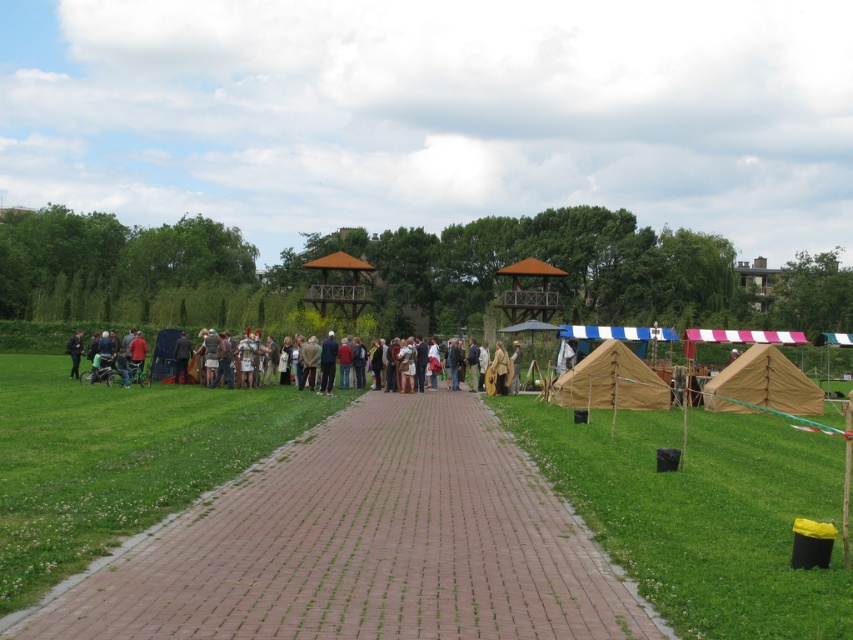
Question: Does tan canvas tent at right come in front of brown canvas tent at center?

Choices:
 (A) no
 (B) yes

Answer: (A)

Question: Is brick paved path at center bigger than brown leather jacket at center?

Choices:
 (A) no
 (B) yes

Answer: (A)

Question: Estimate the real-world distances between objects in this image. Which object is closer to the brown canvas tent at center?

Choices:
 (A) brick paved path at center
 (B) tan canvas tent at right
 (C) brown leather jacket at center

Answer: (B)

Question: Which object is the closest to the brick paved path at center?

Choices:
 (A) tan canvas tent at right
 (B) brown leather jacket at center
 (C) brown canvas tent at center

Answer: (C)

Question: Which point is closer to the camera taking this photo?

Choices:
 (A) (786, 374)
 (B) (151, 362)

Answer: (A)

Question: Is brick paved path at center below tan canvas tent at right?

Choices:
 (A) no
 (B) yes

Answer: (B)